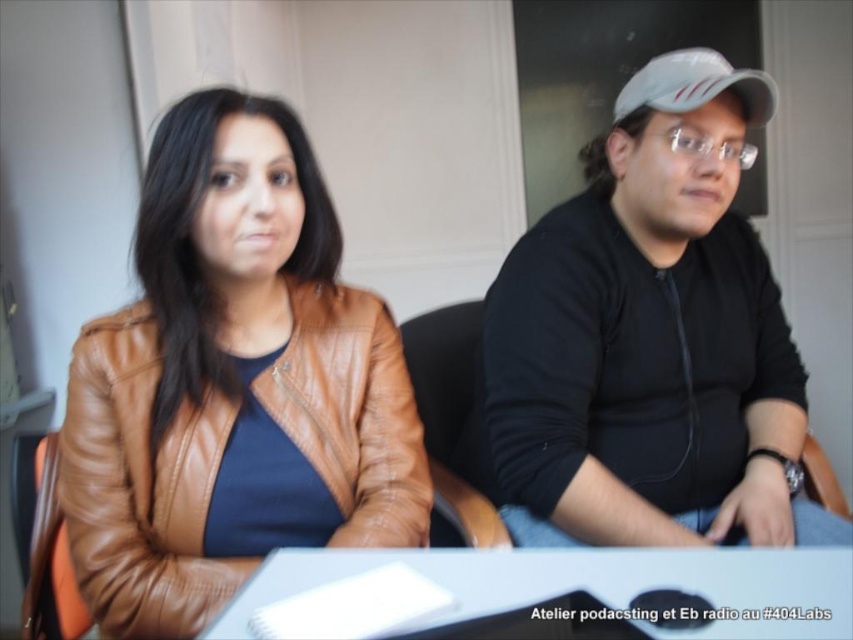
You are a photographer setting up for a photo shoot in the scene described. You need to place a 70 cm long lighting rod between the white glossy table at center and the white matte baseball cap at upper right. Will the lighting rod fit between them without overlapping either object?

The distance between the white glossy table at center and the white matte baseball cap at upper right is 73.84 centimeters. Since the lighting rod is 70 cm long, it will fit between them without overlapping either object as 70 cm is shorter than the 73.84 cm gap.